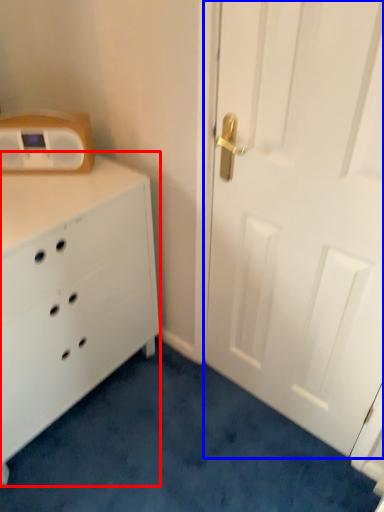
Question: Which object is closer to the camera taking this photo, chest of drawers (highlighted by a red box) or door (highlighted by a blue box)?

Choices:
 (A) chest of drawers
 (B) door

Answer: (B)